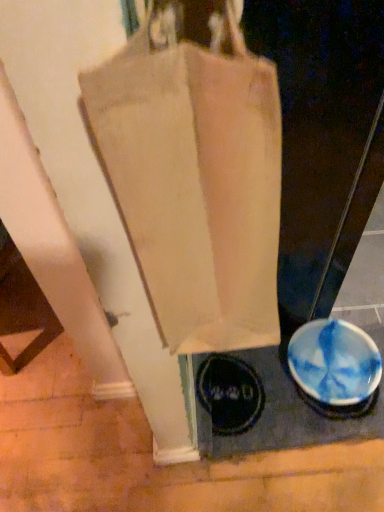
Identify the location of free space in front of blue glossy bowl at lower right. The image size is (384, 512). (324, 479).